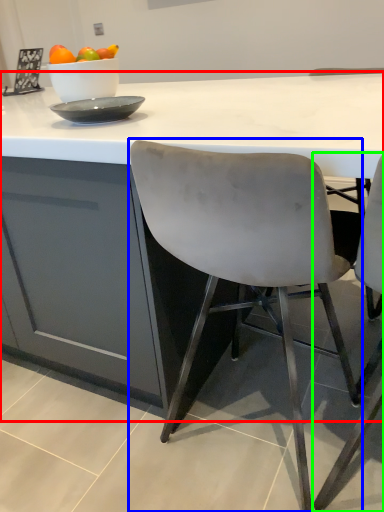
Question: Based on their relative distances, which object is farther from table (highlighted by a red box)? Choose from chair (highlighted by a blue box) and chair (highlighted by a green box).

Choices:
 (A) chair
 (B) chair

Answer: (B)